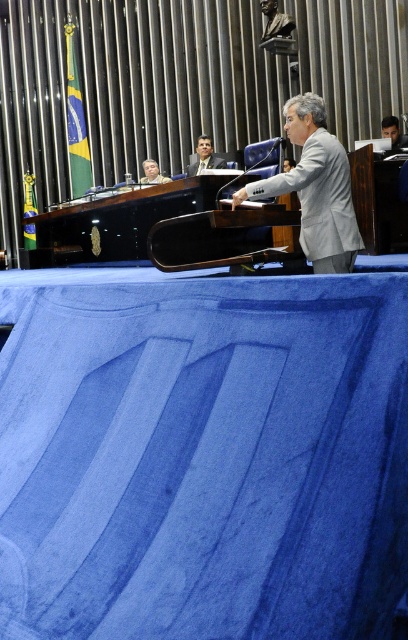
Does matte black laptop at upper right have a greater width compared to matte black laptop at upper center?

Yes.

Does matte black laptop at upper right appear under matte black laptop at upper center?

→ Actually, matte black laptop at upper right is above matte black laptop at upper center.

Is point (396, 129) positioned in front of point (150, 168)?

Yes, point (396, 129) is in front of point (150, 168).

Where is `matte black laptop at upper right`? matte black laptop at upper right is located at coordinates (392, 132).

Is blue fabric ramp at center positioned in front of matte black laptop at upper center?

Yes.

Looking at this image, can you confirm if blue fabric ramp at center is positioned below matte black laptop at upper center?

Yes.

Between point (190, 556) and point (159, 179), which one is positioned behind?

Point (159, 179)

You are a GUI agent. You are given a task and a screenshot of the screen. Output one action in this format:
    pyautogui.click(x=<x>, y=<y>)
    Task: Click on the blue fabric ramp at center
    This screenshot has height=640, width=408.
    Given the screenshot: What is the action you would take?
    pyautogui.click(x=204, y=458)

Can you confirm if matte black suit at upper center is shorter than matte black laptop at upper center?

Correct, matte black suit at upper center is not as tall as matte black laptop at upper center.

Measure the distance between point [208,138] and camera.

Point [208,138] is 10.09 meters away from camera.

Looking at this image, who is more distant from viewer, (208, 147) or (142, 163)?

Point (142, 163)

Image resolution: width=408 pixels, height=640 pixels. Identify the location of matte black suit at upper center. (206, 156).